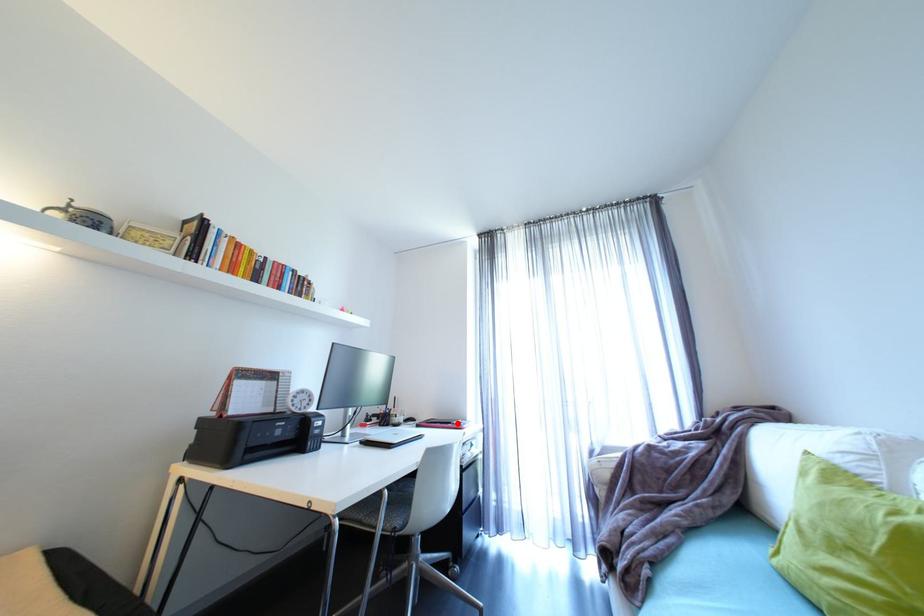
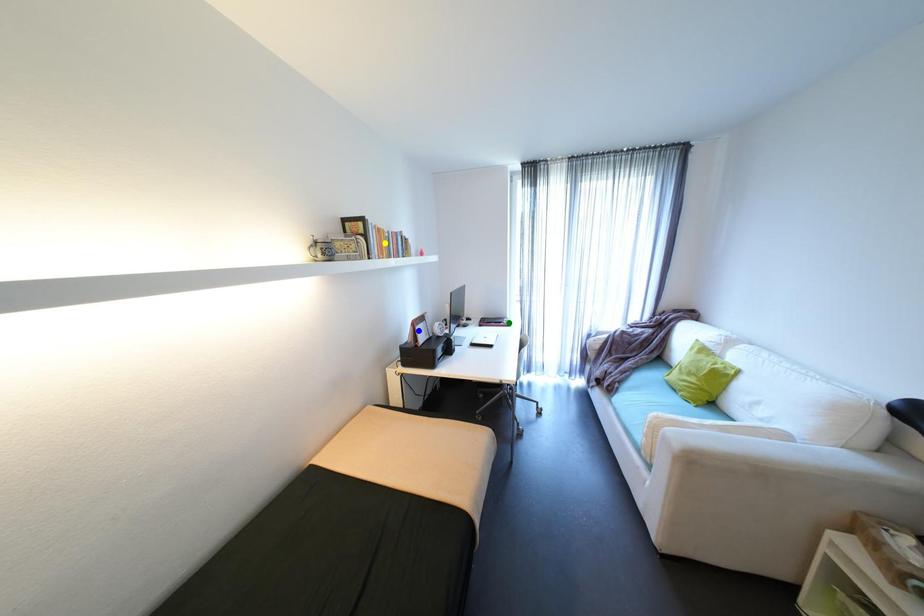
Question: I am providing you with two images of the same scene from different viewpoints. A red point is marked on the first image. You are given multiple points on the second image. Which spot in image 2 lines up with the point in image 1?

Choices:
 (A) yellow point
 (B) green point
 (C) blue point

Answer: (B)